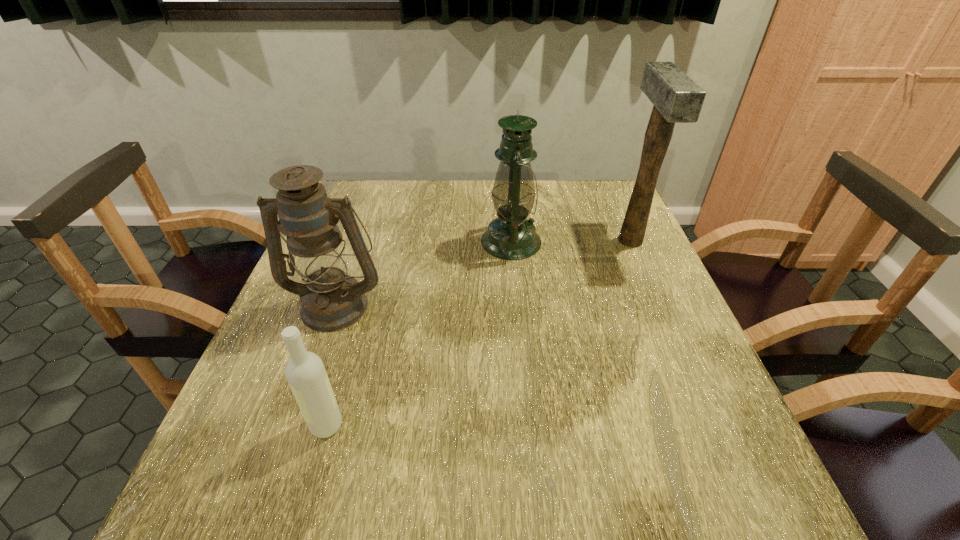
The height and width of the screenshot is (540, 960). I want to click on the rightmost object, so click(676, 98).

At what (x,y) coordinates should I click in order to perform the action: click on mallet. Please return your answer as a coordinate pair (x, y). Image resolution: width=960 pixels, height=540 pixels. Looking at the image, I should click on (676, 98).

The height and width of the screenshot is (540, 960). I want to click on the third object from left to right, so click(511, 236).

Where is `the right oil lamp`? the right oil lamp is located at coordinates (511, 236).

Where is `the second nearest object`? This screenshot has width=960, height=540. the second nearest object is located at coordinates (331, 300).

At what (x,y) coordinates should I click in order to perform the action: click on the left oil lamp. Please return your answer as a coordinate pair (x, y). Looking at the image, I should click on (331, 300).

This screenshot has height=540, width=960. Identify the location of the shortest object. (305, 372).

I want to click on the nearest object, so click(305, 372).

I want to click on vacant point located on the left of the tallest object, so (596, 240).

This screenshot has width=960, height=540. I want to click on free location located on the right of the farther oil lamp, so click(587, 242).